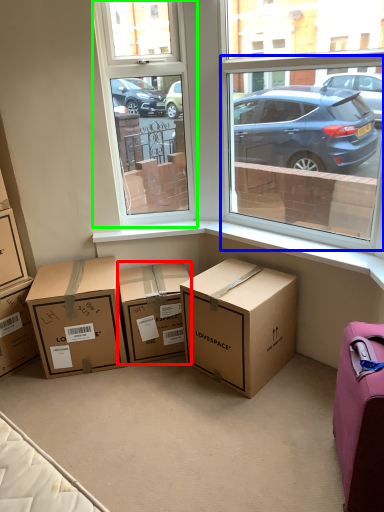
Question: Which object is the farthest from box (highlighted by a red box)? Choose among these: window screen (highlighted by a blue box) or window screen (highlighted by a green box).

Choices:
 (A) window screen
 (B) window screen

Answer: (A)